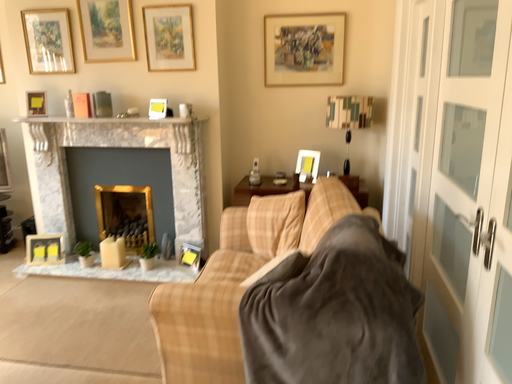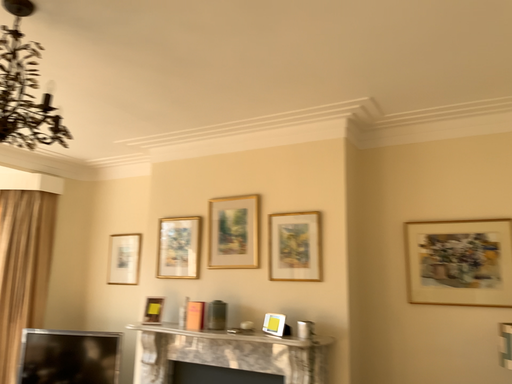
Question: Which way did the camera rotate in the video?

Choices:
 (A) rotated right
 (B) rotated left

Answer: (B)